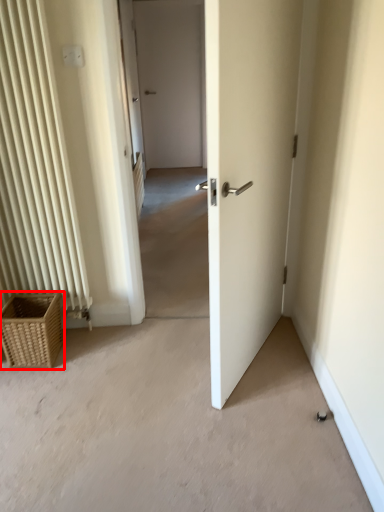
Question: Considering the relative positions of picnic basket (annotated by the red box) and electric outlet in the image provided, where is picnic basket (annotated by the red box) located with respect to the staircase?

Choices:
 (A) left
 (B) right

Answer: (A)